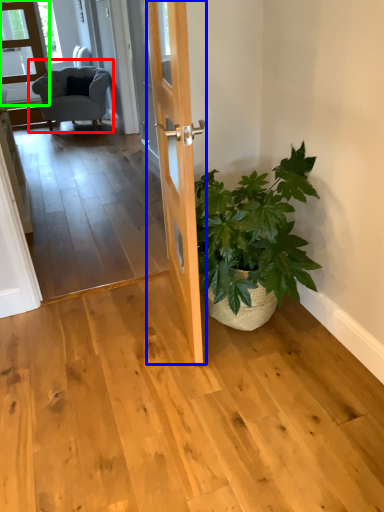
Question: Which is farther away from chair (highlighted by a red box)? door (highlighted by a blue box) or glass door (highlighted by a green box)?

Choices:
 (A) door
 (B) glass door

Answer: (A)